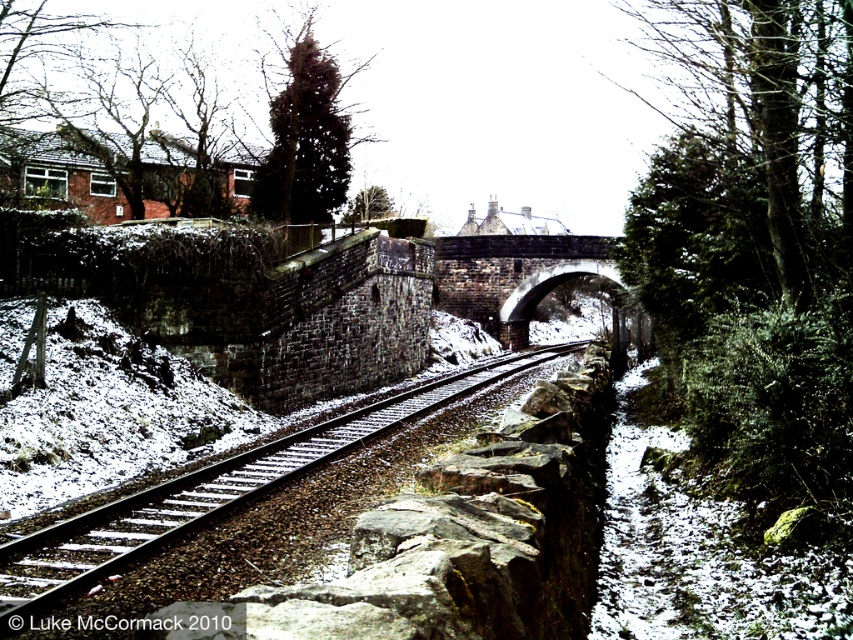
Does metal/smooth track at center appear on the right side of dark gray stone bridge at center?

No, metal/smooth track at center is not to the right of dark gray stone bridge at center.

Who is more distant from viewer, (175, 516) or (485, 285)?

The point (485, 285) is behind.

The image size is (853, 640). I want to click on metal/smooth track at center, so click(x=221, y=486).